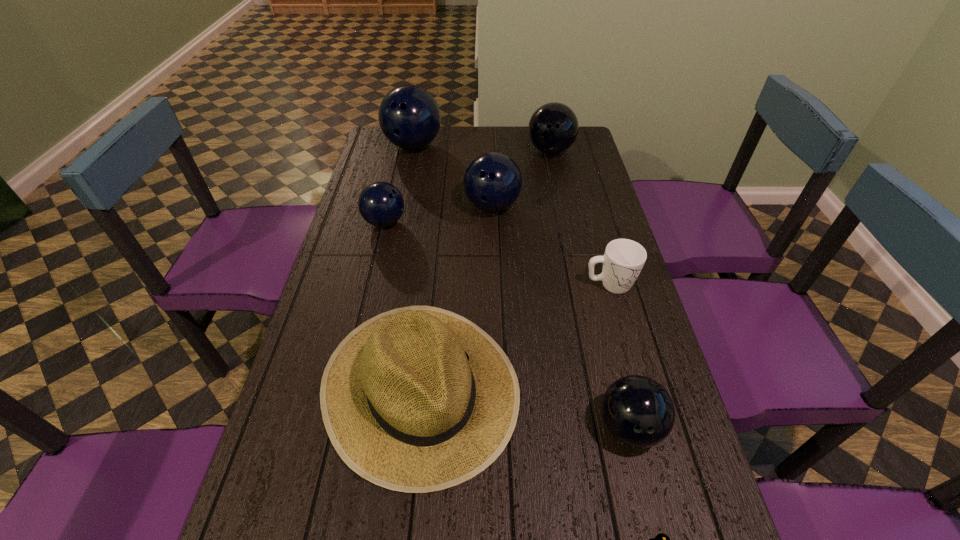
Where is `vacant position located 0.200m on the surface of the tallest bowling ball near the finger holes`? vacant position located 0.200m on the surface of the tallest bowling ball near the finger holes is located at coordinates click(404, 192).

Image resolution: width=960 pixels, height=540 pixels. I want to click on vacant region located 0.220m on the side of the farther black bowling ball with the finger holes, so click(x=561, y=198).

At what (x,y) coordinates should I click in order to perform the action: click on vacant space located 0.300m on the surface of the rightmost blue bowling ball near the finger holes. Please return your answer as a coordinate pair (x, y). The height and width of the screenshot is (540, 960). Looking at the image, I should click on (494, 292).

This screenshot has height=540, width=960. Identify the location of vacant space located on the right of the sunhat. (626, 387).

I want to click on vacant space located 0.240m on the surface of the smallest blue bowling ball near the finger holes, so click(480, 222).

Locate an element on the screen. Image resolution: width=960 pixels, height=540 pixels. vacant area situated on the side of the smaller black bowling ball with the finger holes is located at coordinates (645, 490).

I want to click on sunhat that is at the left edge, so (x=417, y=399).

In order to click on mug at the right edge in this screenshot , I will do `click(623, 260)`.

I want to click on object at the far left corner, so click(x=409, y=117).

At what (x,y) coordinates should I click in order to perform the action: click on object at the far right corner. Please return your answer as a coordinate pair (x, y). Looking at the image, I should click on (553, 128).